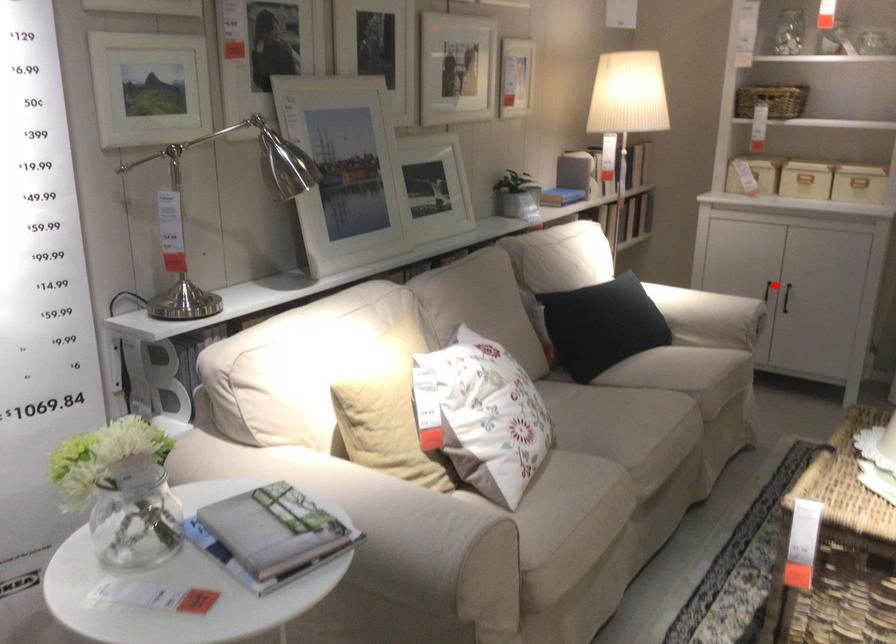
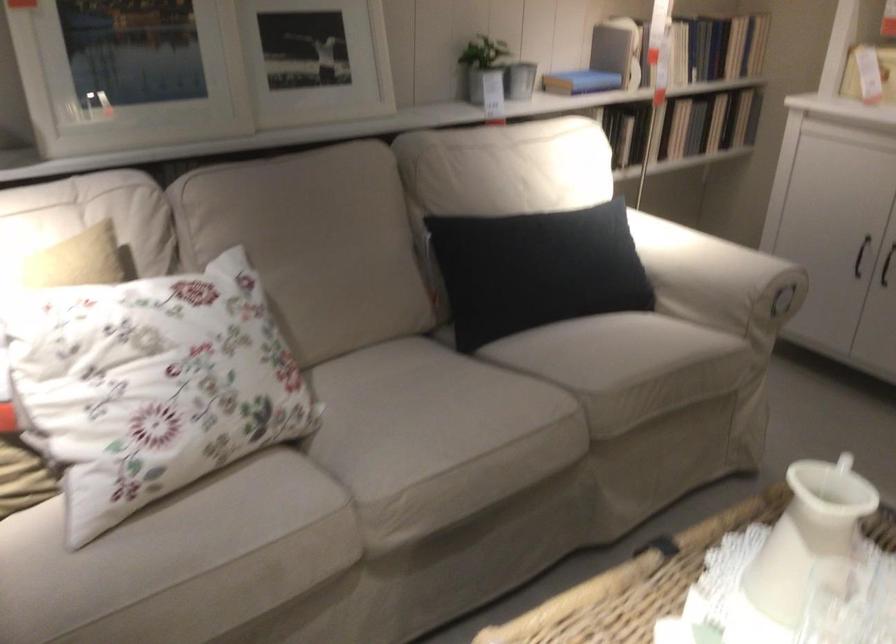
Question: I am providing you with two images of the same scene from different viewpoints. Image1 has a red point marked. In image2, the corresponding 3D location appears at what relative position? Reply with the corresponding letter.

Choices:
 (A) Closer
 (B) Farther

Answer: (A)